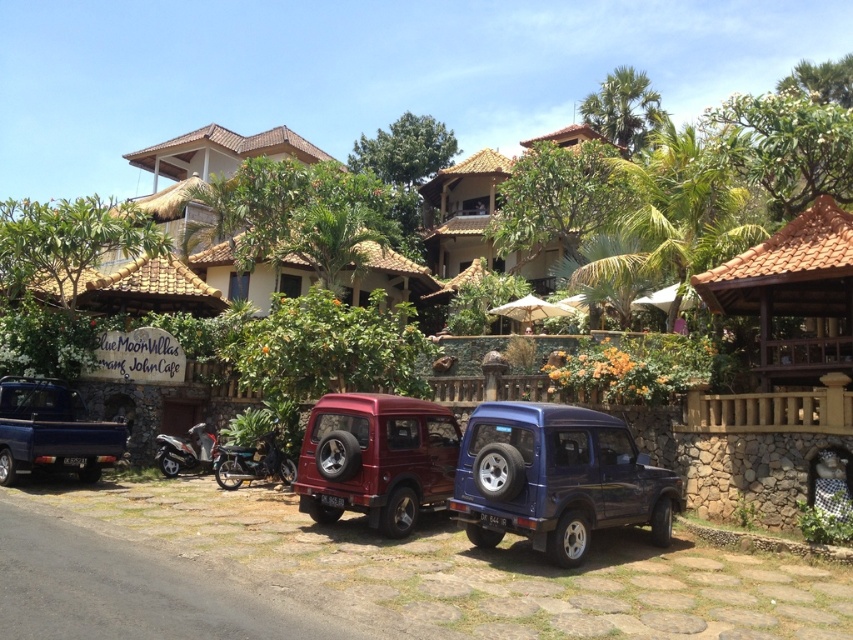
Question: Which point appears closest to the camera in this image?

Choices:
 (A) (51, 401)
 (B) (265, 467)

Answer: (A)

Question: Can you confirm if metallic blue suv at center is thinner than matte black truck at left?

Choices:
 (A) no
 (B) yes

Answer: (A)

Question: In this image, where is metallic blue suv at center located relative to metallic red suv at center?

Choices:
 (A) above
 (B) below

Answer: (B)

Question: Is metallic red suv at center further to the viewer compared to matte black truck at left?

Choices:
 (A) no
 (B) yes

Answer: (A)

Question: Which of the following is the farthest from the observer?

Choices:
 (A) (202, 451)
 (B) (62, 458)

Answer: (A)

Question: Which of the following is the closest to the observer?

Choices:
 (A) metallic silver scooter at lower left
 (B) metallic red suv at center
 (C) metallic blue suv at center

Answer: (C)